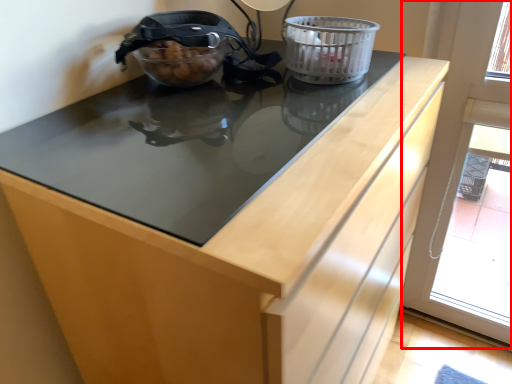
Question: Observing the image, what is the correct spatial positioning of screen door (annotated by the red box) in reference to basket container?

Choices:
 (A) right
 (B) left

Answer: (A)